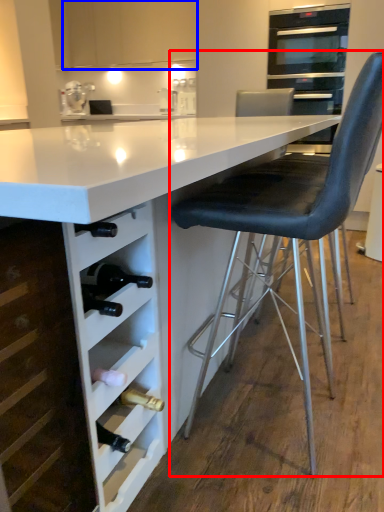
Question: Which point is further to the camera, chair (highlighted by a red box) or cabinetry (highlighted by a blue box)?

Choices:
 (A) chair
 (B) cabinetry

Answer: (B)